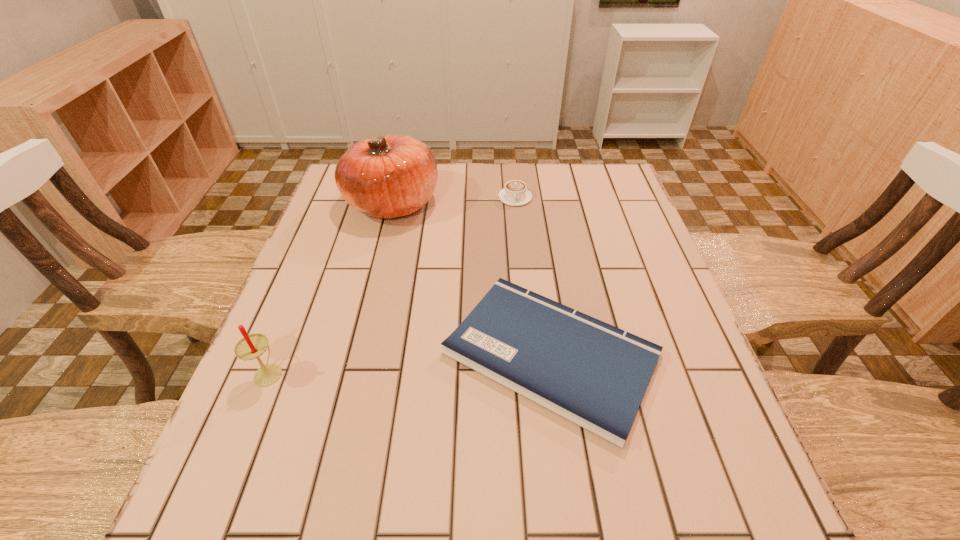
Locate an element on the screen. pumpkin is located at coordinates (389, 176).

Locate an element on the screen. the second tallest object is located at coordinates (252, 346).

At what (x,y) coordinates should I click in order to perform the action: click on the second shortest object. Please return your answer as a coordinate pair (x, y). The width and height of the screenshot is (960, 540). Looking at the image, I should click on (515, 193).

The width and height of the screenshot is (960, 540). Identify the location of the shortest object. coord(594,374).

The height and width of the screenshot is (540, 960). Find the location of `vacant region located 0.300m on the right of the tallest object`. vacant region located 0.300m on the right of the tallest object is located at coordinates (542, 203).

Find the location of a particular element. The width and height of the screenshot is (960, 540). free space located on the right of the third shortest object is located at coordinates (324, 372).

At what (x,y) coordinates should I click in order to perform the action: click on vacant space situated 0.190m with the handle on the right side of the third tallest object. Please return your answer as a coordinate pair (x, y). The width and height of the screenshot is (960, 540). Looking at the image, I should click on (520, 249).

Locate an element on the screen. This screenshot has width=960, height=540. vacant point located 0.140m on the left of the paperback book is located at coordinates (373, 354).

This screenshot has width=960, height=540. Find the location of `pumpkin located at the far edge`. pumpkin located at the far edge is located at coordinates (389, 176).

Locate an element on the screen. The height and width of the screenshot is (540, 960). cappuccino present at the far edge is located at coordinates (515, 193).